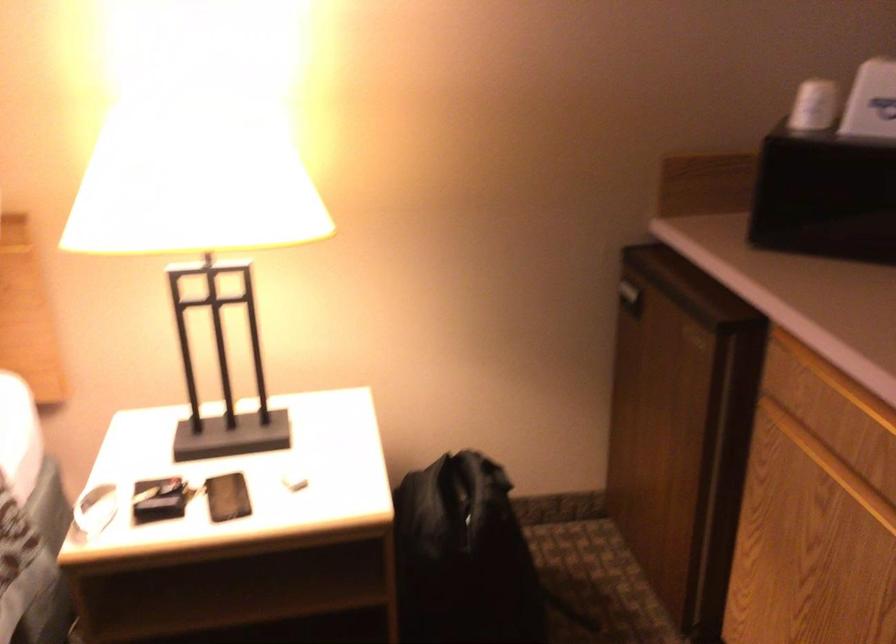
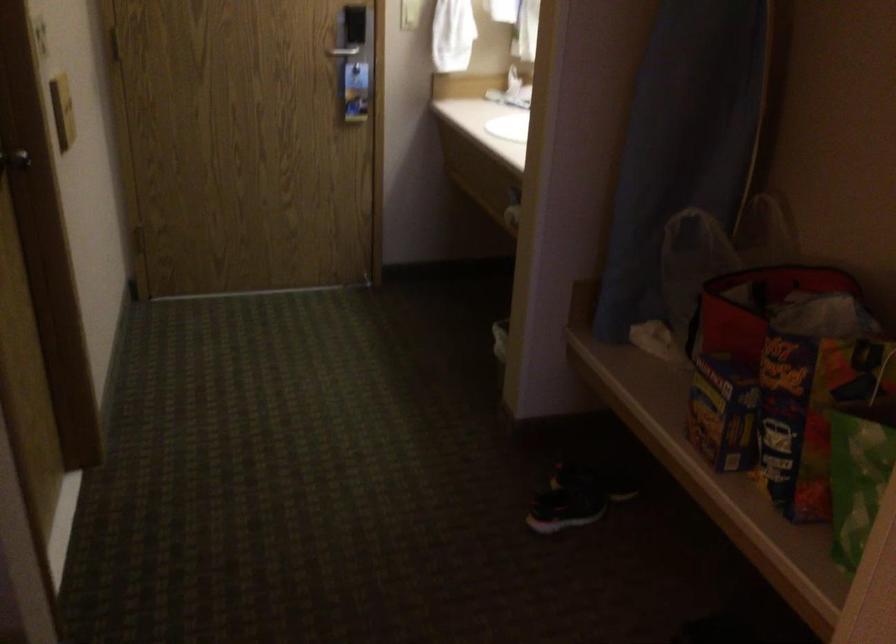
The images are taken continuously from a first-person perspective. In which direction is your viewpoint rotating?

The camera rotated toward right-down.